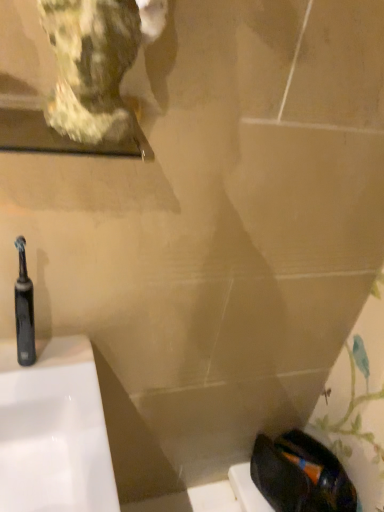
Question: From the image's perspective, is black rubber toothbrush at left positioned above or below marble statue at upper left?

Choices:
 (A) below
 (B) above

Answer: (A)

Question: From a real-world perspective, relative to marble statue at upper left, is black rubber toothbrush at left vertically above or below?

Choices:
 (A) below
 (B) above

Answer: (A)

Question: Considering their positions, is black rubber toothbrush at left located in front of or behind marble statue at upper left?

Choices:
 (A) behind
 (B) front

Answer: (A)

Question: In the image, is marble statue at upper left positioned in front of or behind black rubber toothbrush at left?

Choices:
 (A) behind
 (B) front

Answer: (B)

Question: From a real-world perspective, is marble statue at upper left above or below black rubber toothbrush at left?

Choices:
 (A) above
 (B) below

Answer: (A)

Question: Looking at the image, does marble statue at upper left seem bigger or smaller compared to black rubber toothbrush at left?

Choices:
 (A) big
 (B) small

Answer: (A)

Question: From the image's perspective, is marble statue at upper left positioned above or below black rubber toothbrush at left?

Choices:
 (A) above
 (B) below

Answer: (A)